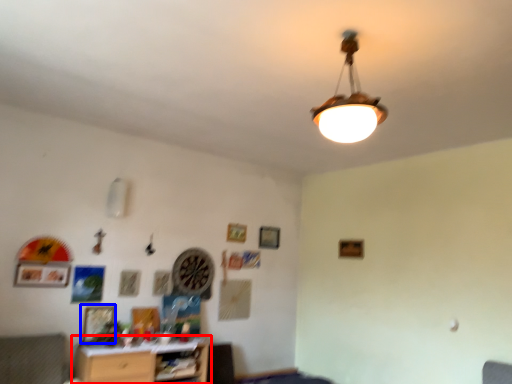
Question: Which object appears closest to the camera in this image, table (highlighted by a red box) or picture frame (highlighted by a blue box)?

Choices:
 (A) table
 (B) picture frame

Answer: (A)